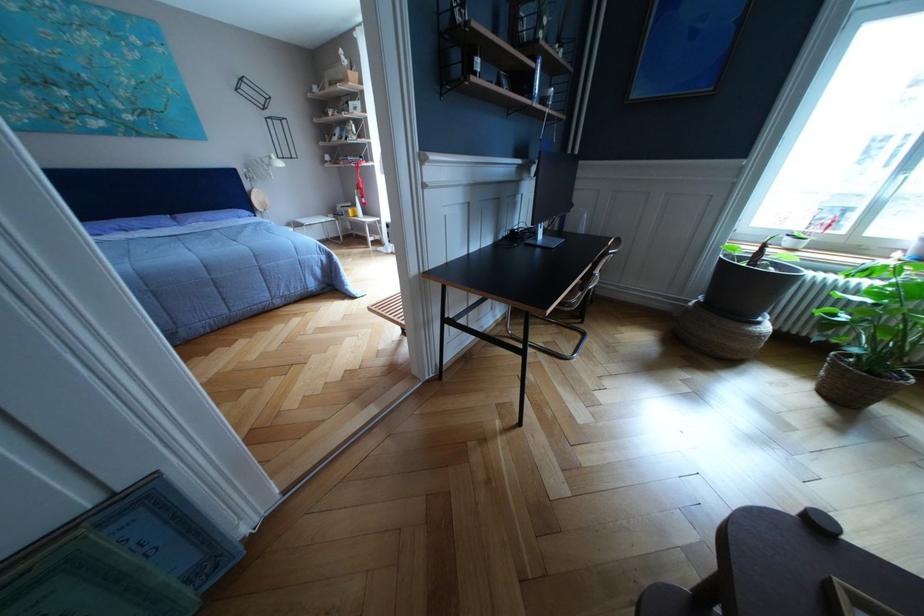
The location [748,286] corresponds to which object?

This point indicates the wicker plant pot.